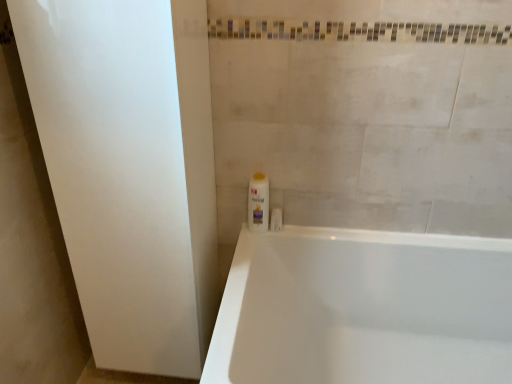
Question: Are white matte screen door at left and white glossy bathtub at lower right beside each other?

Choices:
 (A) yes
 (B) no

Answer: (B)

Question: From a real-world perspective, is white matte screen door at left under white glossy bathtub at lower right?

Choices:
 (A) yes
 (B) no

Answer: (B)

Question: Is white matte screen door at left not close to white glossy bathtub at lower right?

Choices:
 (A) no
 (B) yes

Answer: (A)

Question: From the image's perspective, is white matte screen door at left on white glossy bathtub at lower right?

Choices:
 (A) yes
 (B) no

Answer: (A)

Question: Does white matte screen door at left have a larger size compared to white glossy bathtub at lower right?

Choices:
 (A) yes
 (B) no

Answer: (B)

Question: From their relative heights in the image, would you say white glossy bathtub at lower right is taller or shorter than white plastic bottle at center?

Choices:
 (A) short
 (B) tall

Answer: (B)

Question: In the image, is white glossy bathtub at lower right positioned in front of or behind white plastic bottle at center?

Choices:
 (A) front
 (B) behind

Answer: (A)

Question: Is white glossy bathtub at lower right spatially inside white plastic bottle at center, or outside of it?

Choices:
 (A) inside
 (B) outside

Answer: (B)

Question: From a real-world perspective, is white glossy bathtub at lower right positioned above or below white plastic bottle at center?

Choices:
 (A) above
 (B) below

Answer: (B)

Question: Is white matte screen door at left taller or shorter than white glossy bathtub at lower right?

Choices:
 (A) tall
 (B) short

Answer: (A)

Question: Considering the relative positions of white matte screen door at left and white glossy bathtub at lower right in the image provided, is white matte screen door at left to the left or to the right of white glossy bathtub at lower right?

Choices:
 (A) right
 (B) left

Answer: (B)

Question: From the image's perspective, relative to white glossy bathtub at lower right, is white matte screen door at left above or below?

Choices:
 (A) above
 (B) below

Answer: (A)

Question: Is white matte screen door at left situated inside white glossy bathtub at lower right or outside?

Choices:
 (A) outside
 (B) inside

Answer: (A)

Question: Looking at the image, does white plastic bottle at center seem bigger or smaller compared to white matte screen door at left?

Choices:
 (A) big
 (B) small

Answer: (B)

Question: From a real-world perspective, relative to white matte screen door at left, is white plastic bottle at center vertically above or below?

Choices:
 (A) above
 (B) below

Answer: (A)